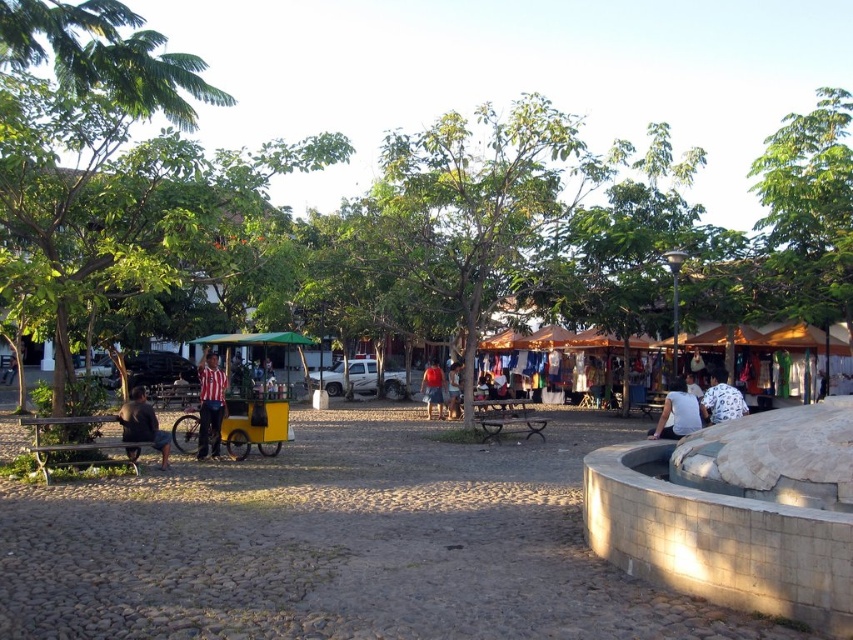
Can you confirm if dark gray fabric shirt at lower left is positioned to the right of matte red shirt at center?

Incorrect, dark gray fabric shirt at lower left is not on the right side of matte red shirt at center.

Who is more distant from viewer, (134, 452) or (457, 406)?

Positioned behind is point (457, 406).

The width and height of the screenshot is (853, 640). Find the location of `dark gray fabric shirt at lower left`. dark gray fabric shirt at lower left is located at coordinates (142, 424).

Which is below, white cotton shirt at lower right or denim shorts at center?

denim shorts at center

How distant is white cotton shirt at lower right from denim shorts at center?

white cotton shirt at lower right is 12.99 meters away from denim shorts at center.

Does point (686, 410) come farther from viewer compared to point (425, 385)?

No, it is not.

Where is `white cotton shirt at lower right`? white cotton shirt at lower right is located at coordinates (677, 412).

What do you see at coordinates (254, 413) in the screenshot? Image resolution: width=853 pixels, height=640 pixels. I see `yellow matte cart at center` at bounding box center [254, 413].

Is point (265, 400) behind point (730, 385)?

No, (265, 400) is closer to viewer.

Is point (234, 410) behind point (712, 385)?

No, (234, 410) is closer to viewer.

This screenshot has height=640, width=853. Find the location of `yellow matte cart at center`. yellow matte cart at center is located at coordinates (254, 413).